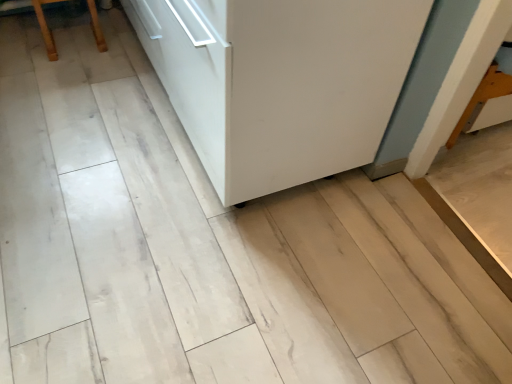
The width and height of the screenshot is (512, 384). What are the coordinates of `free point to the right of wooden chair legs at upper left` in the screenshot? It's located at (123, 57).